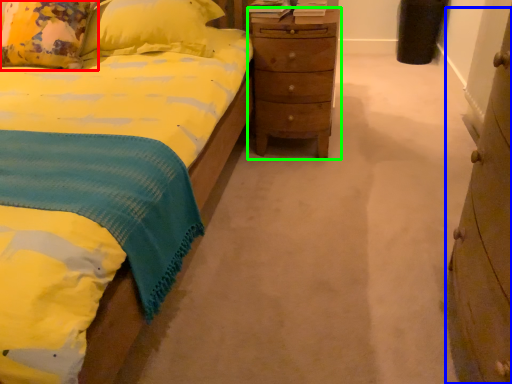
Question: Which object is positioned closest to pillow (highlighted by a red box)? Select from chest of drawers (highlighted by a blue box) and nightstand (highlighted by a green box).

Choices:
 (A) chest of drawers
 (B) nightstand

Answer: (B)